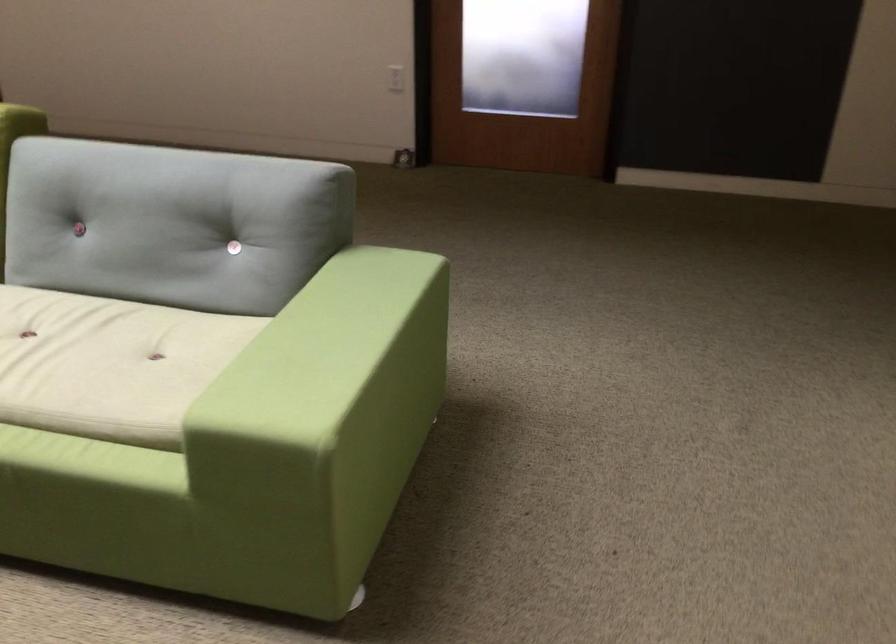
Describe the element at coordinates (323, 353) in the screenshot. I see `the green sofa armrest` at that location.